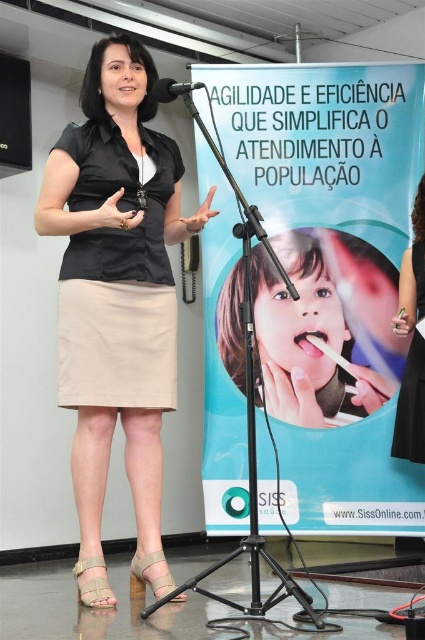
Question: Which of the following is the closest to the observer?

Choices:
 (A) (396, 429)
 (B) (142, 545)

Answer: (B)

Question: Can you confirm if black satin dress at right is bigger than black matte microphone at upper center?

Choices:
 (A) yes
 (B) no

Answer: (A)

Question: Is black leather skirt at lower left closer to the viewer compared to black satin dress at right?

Choices:
 (A) yes
 (B) no

Answer: (B)

Question: Which point is closer to the camera taking this photo?

Choices:
 (A) (30, 154)
 (B) (407, 419)

Answer: (B)

Question: Which point is farther to the camera?

Choices:
 (A) black matte microphone at upper center
 (B) black leather skirt at lower left

Answer: (B)

Question: Does blue glossy poster at center lie behind beige fabric skirt at center?

Choices:
 (A) no
 (B) yes

Answer: (B)